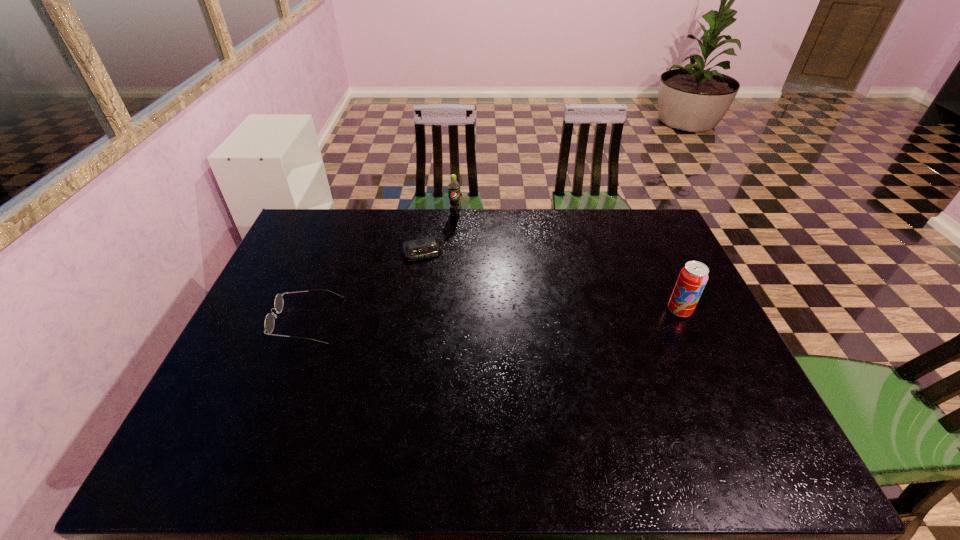
What are the coordinates of `free space at the near edge` in the screenshot? It's located at (589, 405).

Find the location of a particular element. Image resolution: width=960 pixels, height=540 pixels. free location at the left edge of the desktop is located at coordinates (269, 314).

You are a GUI agent. You are given a task and a screenshot of the screen. Output one action in this format:
    pyautogui.click(x=<x>, y=<y>)
    Task: Click on the blank space at the right edge of the desktop
    The width and height of the screenshot is (960, 540).
    Given the screenshot: What is the action you would take?
    pyautogui.click(x=656, y=288)

In the image, there is a desktop. Where is `vacant space at the far left corner`? This screenshot has height=540, width=960. vacant space at the far left corner is located at coordinates (335, 234).

At what (x,y) coordinates should I click in order to perform the action: click on free space at the near left corner of the desktop. Please return your answer as a coordinate pair (x, y). Image resolution: width=960 pixels, height=540 pixels. Looking at the image, I should click on (215, 409).

Where is `free space between the second shortest object and the alarm clock`? The height and width of the screenshot is (540, 960). free space between the second shortest object and the alarm clock is located at coordinates (364, 286).

Locate an element on the screen. This screenshot has height=540, width=960. free spot between the leftmost object and the alarm clock is located at coordinates (364, 286).

In order to click on vacant region between the leftmost object and the shortest object in this screenshot , I will do `click(364, 286)`.

Locate an element on the screen. vacant region between the second farthest object and the nearer soda is located at coordinates pyautogui.click(x=550, y=281).

You are a GUI agent. You are given a task and a screenshot of the screen. Output one action in this format:
    pyautogui.click(x=<x>, y=<y>)
    Task: Click on the free space between the rightmost object and the second shortest object
    
    Given the screenshot: What is the action you would take?
    pyautogui.click(x=492, y=315)